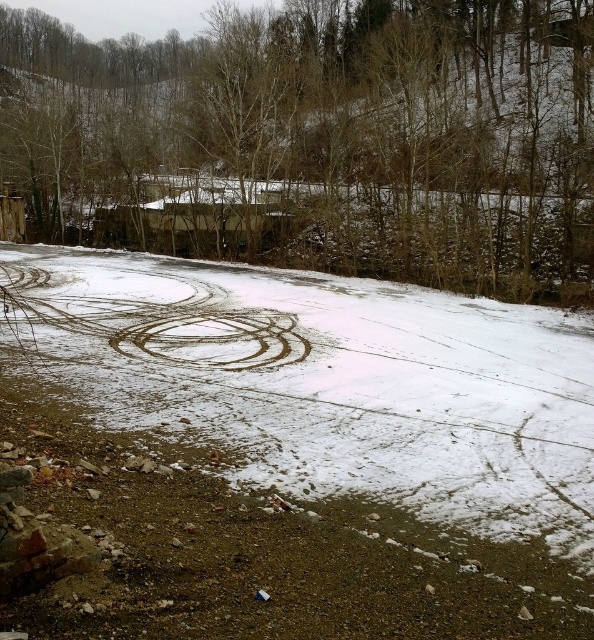
Question: Which object is positioned closest to the brown leafless tree at center?

Choices:
 (A) brown dirt track at center
 (B) brown gravel dirt track at center

Answer: (A)

Question: From the image, what is the correct spatial relationship of brown leafless tree at center in relation to brown dirt track at center?

Choices:
 (A) above
 (B) below

Answer: (A)

Question: Does brown gravel dirt track at center come in front of brown leafless tree at center?

Choices:
 (A) yes
 (B) no

Answer: (A)

Question: Estimate the real-world distances between objects in this image. Which object is farther from the brown gravel dirt track at center?

Choices:
 (A) brown dirt track at center
 (B) brown leafless tree at center

Answer: (B)

Question: From the image, what is the correct spatial relationship of brown gravel dirt track at center in relation to brown dirt track at center?

Choices:
 (A) left
 (B) right

Answer: (B)

Question: Estimate the real-world distances between objects in this image. Which object is closer to the brown leafless tree at center?

Choices:
 (A) brown dirt track at center
 (B) brown gravel dirt track at center

Answer: (A)